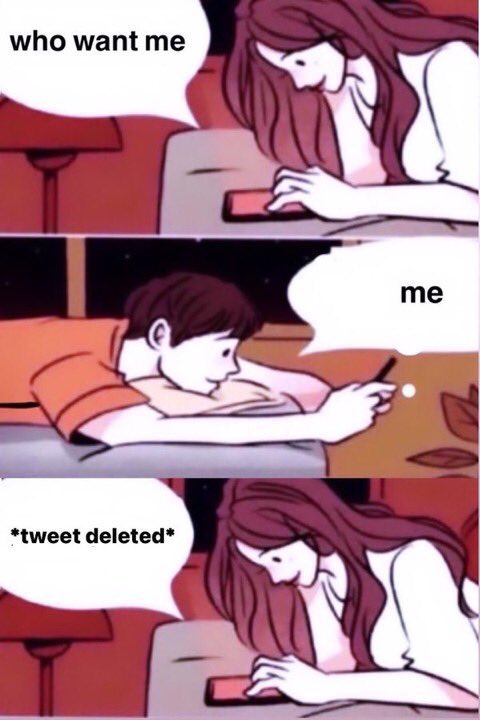
The height and width of the screenshot is (720, 480). What are the coordinates of `window` in the screenshot? It's located at (212, 508), (230, 260), (38, 274), (225, 17).